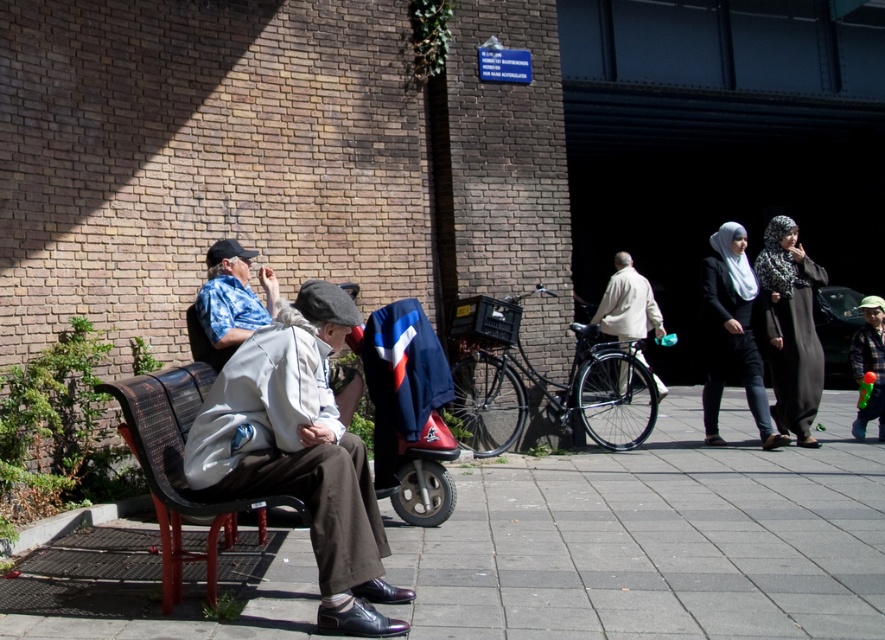
You are standing at the point with coordinates point (387, 554) and want to walk to the point with coordinates point (608, 573). Based on the scene description, will you be moving forward or backward?

Based on the coordinates provided, point (608, 573) is behind point (387, 554). Therefore, moving from point (387, 554) to point (608, 573) would require moving backward.

You are standing in the public space and want to place a small potted plant between the smooth concrete pavement at lower left and the blue patterned shirt at left. Based on their positions, which object should the plant be closer to?

The smooth concrete pavement at lower left is positioned on the right side of blue patterned shirt at left, so the plant should be placed closer to the blue patterned shirt at left to be between them.

You are standing at the edge of the scene and want to walk towards the blue patterned shirt at left. Is the smooth concrete pavement at lower left wide enough for you to walk on comfortably?

Result: The smooth concrete pavement at lower left might be wider than blue patterned shirt at left, so it could be wide enough for comfortable walking.